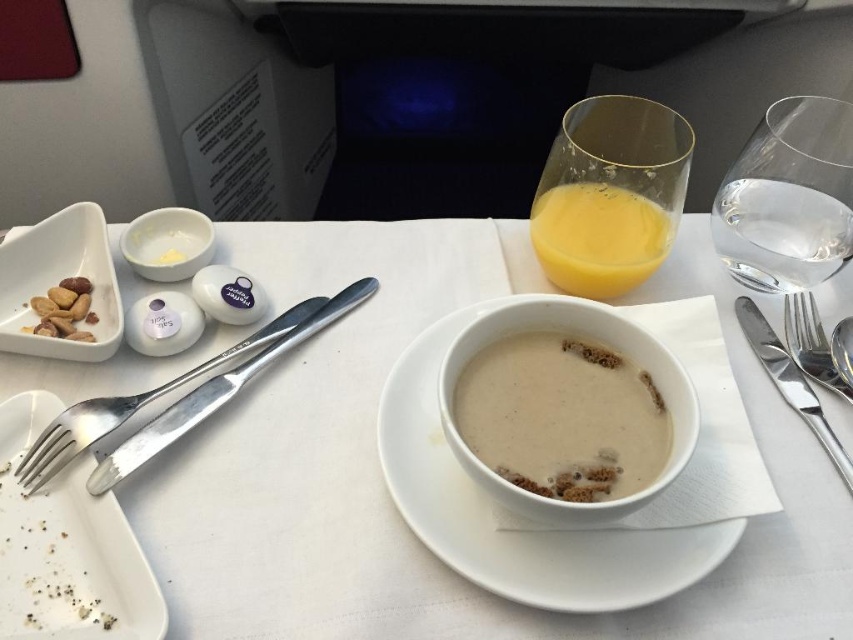
Question: Considering the relative positions of white ceramic plate at center and silver metallic knife at upper right in the image provided, where is white ceramic plate at center located with respect to silver metallic knife at upper right?

Choices:
 (A) below
 (B) above

Answer: (A)

Question: Does white matte plate at lower left have a larger size compared to silver metallic knife at upper right?

Choices:
 (A) yes
 (B) no

Answer: (A)

Question: Which point is farther to the camera?

Choices:
 (A) white matte plate at center
 (B) satin silver knife at right

Answer: (B)

Question: Can you confirm if translucent glass of orange juice at upper right is positioned to the right of polished metal fork at left?

Choices:
 (A) no
 (B) yes

Answer: (B)

Question: Among these points, which one is nearest to the camera?

Choices:
 (A) (761, 227)
 (B) (639, 276)

Answer: (B)

Question: Which of the following is the closest to the observer?

Choices:
 (A) clear glass water at upper right
 (B) white matte plate at center
 (C) matte brown nuts at left

Answer: (B)